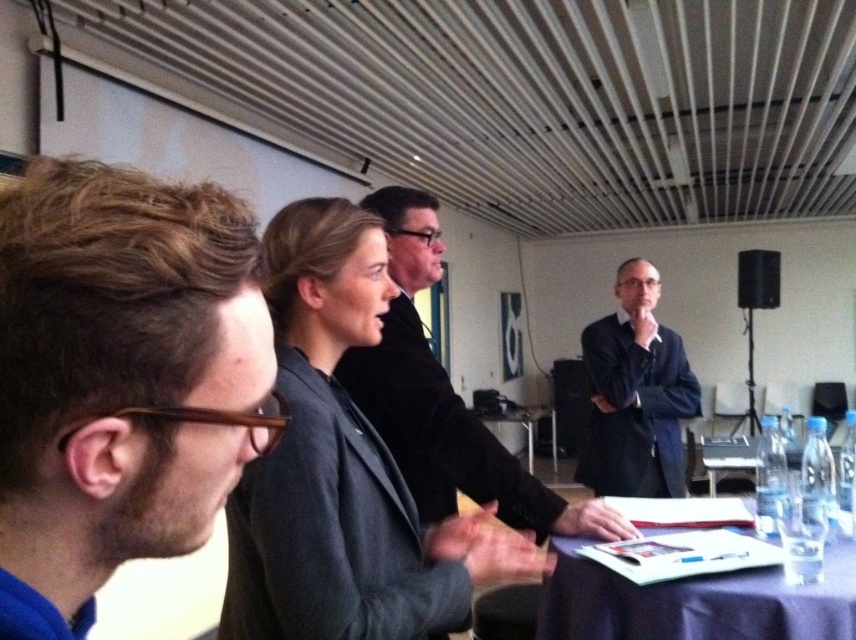
How much distance is there between brown hair at left and black matte speaker at upper right?

They are 22.41 feet apart.

Looking at this image, which is more to the left, brown hair at left or black matte speaker at upper right?

Positioned to the left is brown hair at left.

Does point (204, 337) come behind point (759, 305)?

No, (204, 337) is in front of (759, 305).

Locate an element on the screen. The width and height of the screenshot is (856, 640). brown hair at left is located at coordinates (120, 376).

Can you confirm if clear plastic bottles at lower right is positioned to the left of dark wood table at center?

No, clear plastic bottles at lower right is not to the left of dark wood table at center.

Can you confirm if clear plastic bottles at lower right is taller than dark wood table at center?

No, clear plastic bottles at lower right is not taller than dark wood table at center.

At what (x,y) coordinates should I click in order to perform the action: click on clear plastic bottles at lower right. Please return your answer as a coordinate pair (x, y). The width and height of the screenshot is (856, 640). Looking at the image, I should click on (728, 458).

Between dark gray woolen blazer at center and black matte speaker at upper right, which one appears on the right side from the viewer's perspective?

Positioned to the right is black matte speaker at upper right.

Can you confirm if dark gray woolen blazer at center is bigger than black matte speaker at upper right?

Yes, dark gray woolen blazer at center is bigger than black matte speaker at upper right.

The height and width of the screenshot is (640, 856). Find the location of `dark gray woolen blazer at center`. dark gray woolen blazer at center is located at coordinates (331, 531).